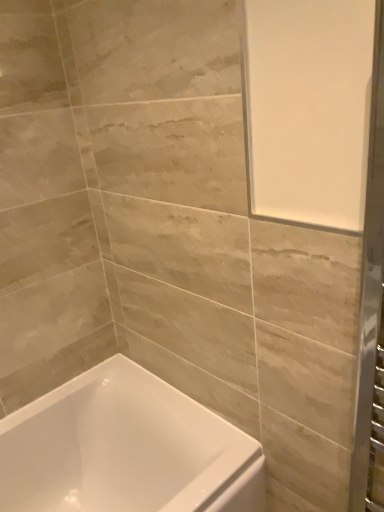
Locate an element on the screen. The height and width of the screenshot is (512, 384). white glossy bathtub at lower left is located at coordinates (126, 449).

This screenshot has height=512, width=384. What do you see at coordinates (126, 449) in the screenshot? I see `white glossy bathtub at lower left` at bounding box center [126, 449].

In order to click on white glossy bathtub at lower left in this screenshot , I will do `click(126, 449)`.